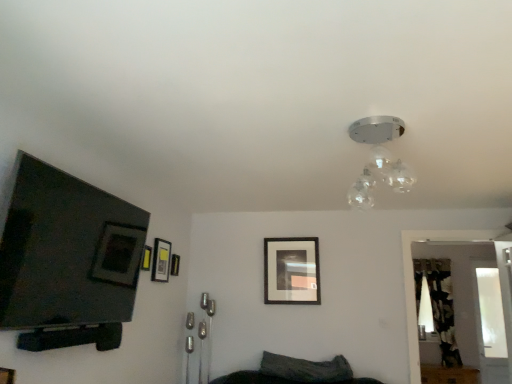
Question: Is point (461, 301) positioned closer to the camera than point (145, 254)?

Choices:
 (A) closer
 (B) farther

Answer: (B)

Question: Would you say transparent glass door at right is to the left or to the right of matte black picture frame at upper left, which is the 4th picture frame in right-to-left order, in the picture?

Choices:
 (A) left
 (B) right

Answer: (B)

Question: Which object is the closest to the dark gray fabric pillow at lower center?

Choices:
 (A) transparent glass door at right
 (B) camouflage fabric curtain at right
 (C) clear glass light fixture at upper center
 (D) transparent glass door at right
 (E) matte black picture frame at upper left, placed as the third picture frame when sorted from left to right

Answer: (E)

Question: Which of these objects is positioned closest to the clear glass light fixture at upper center?

Choices:
 (A) camouflage fabric curtain at right
 (B) matte black picture frame at upper left, the second picture frame when ordered from back to front
 (C) dark gray fabric pillow at lower center
 (D) transparent glass door at right
 (E) transparent glass door at right

Answer: (C)